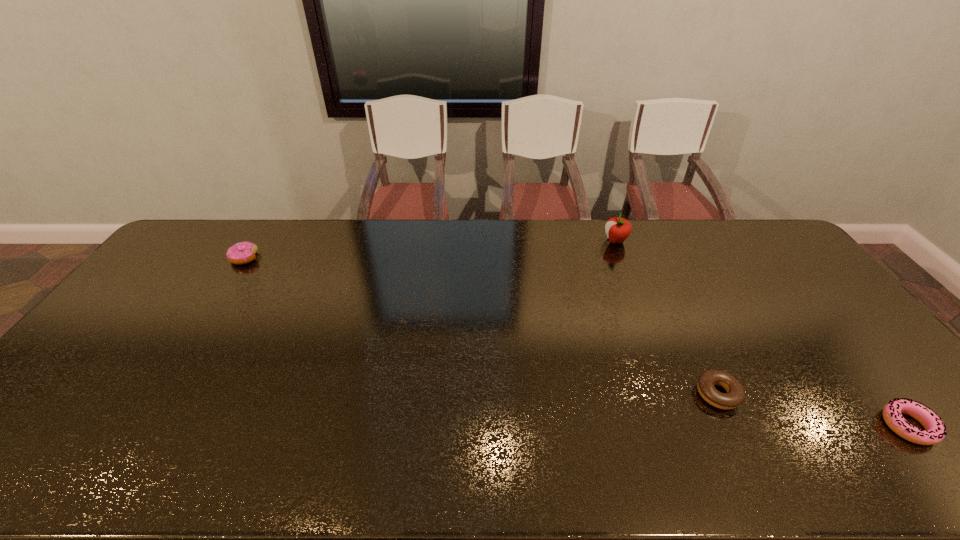
The width and height of the screenshot is (960, 540). In order to click on apple situated at the far edge in this screenshot , I will do `click(617, 229)`.

You are a GUI agent. You are given a task and a screenshot of the screen. Output one action in this format:
    pyautogui.click(x=<x>, y=<y>)
    Task: Click on the doughnut at the far edge
    This screenshot has height=540, width=960.
    Given the screenshot: What is the action you would take?
    click(x=240, y=253)

Where is `object situated at the near edge`? object situated at the near edge is located at coordinates (935, 430).

Locate an element on the screen. object located at the right edge is located at coordinates (935, 430).

Locate an element on the screen. Image resolution: width=960 pixels, height=540 pixels. object located in the near right corner section of the desktop is located at coordinates (935, 430).

Find the location of a particular element. The height and width of the screenshot is (540, 960). vacant space at the far edge is located at coordinates coord(456,231).

Find the location of a particular element. The height and width of the screenshot is (540, 960). vacant space at the near edge of the desktop is located at coordinates (572, 476).

Where is `free region at the left edge`? free region at the left edge is located at coordinates [165, 292].

Where is `free spot at the right edge of the desktop`? Image resolution: width=960 pixels, height=540 pixels. free spot at the right edge of the desktop is located at coordinates (864, 337).

Find the location of a particular element. free space at the far left corner of the desktop is located at coordinates (195, 226).